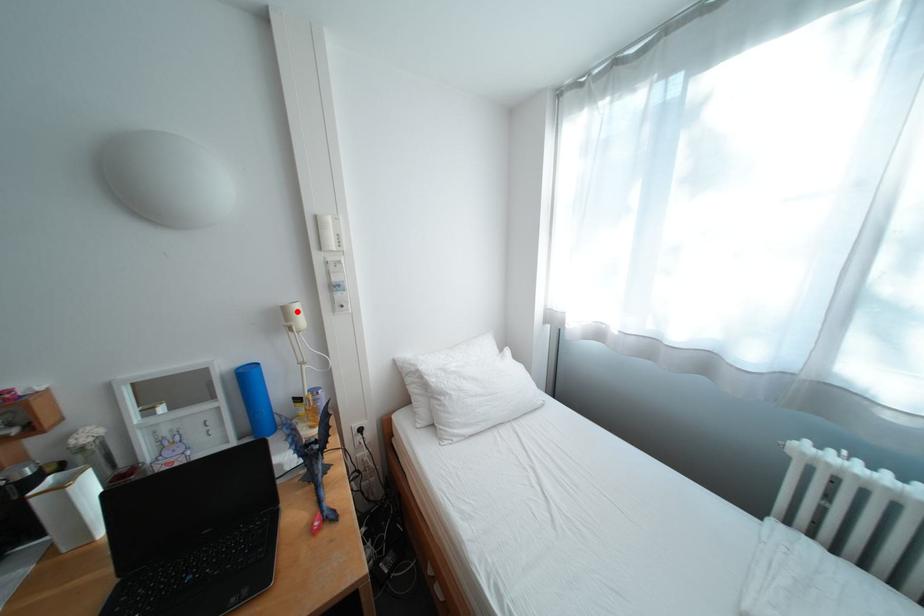
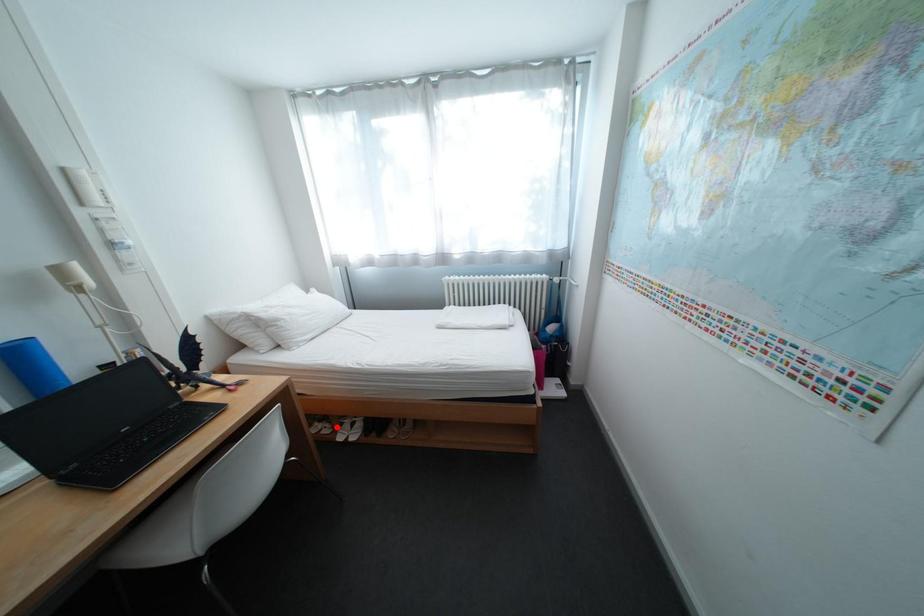
I am providing you with two images of the same scene from different viewpoints. A red point is marked on the first image and another point is marked on the second image. Do the highlighted points in image1 and image2 indicate the same real-world spot?

No